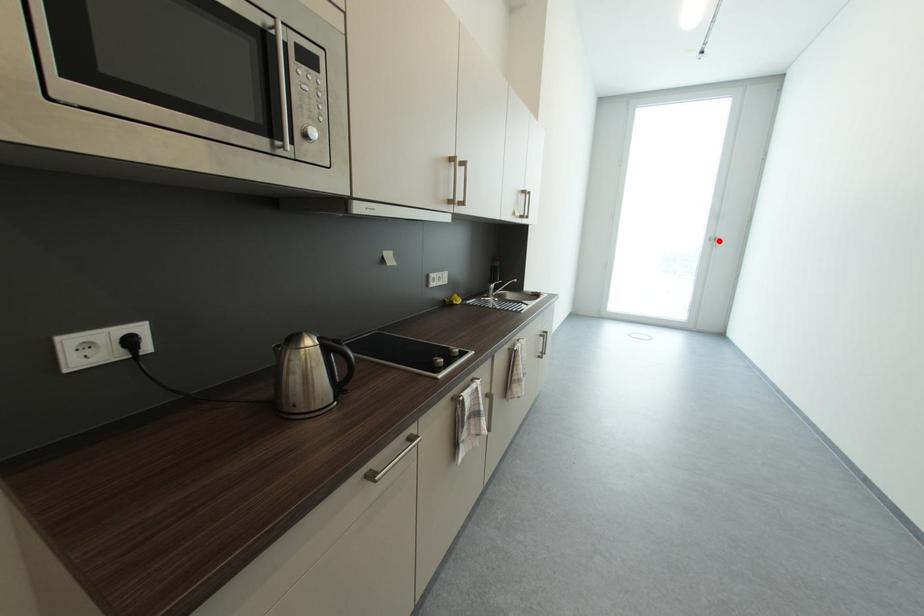
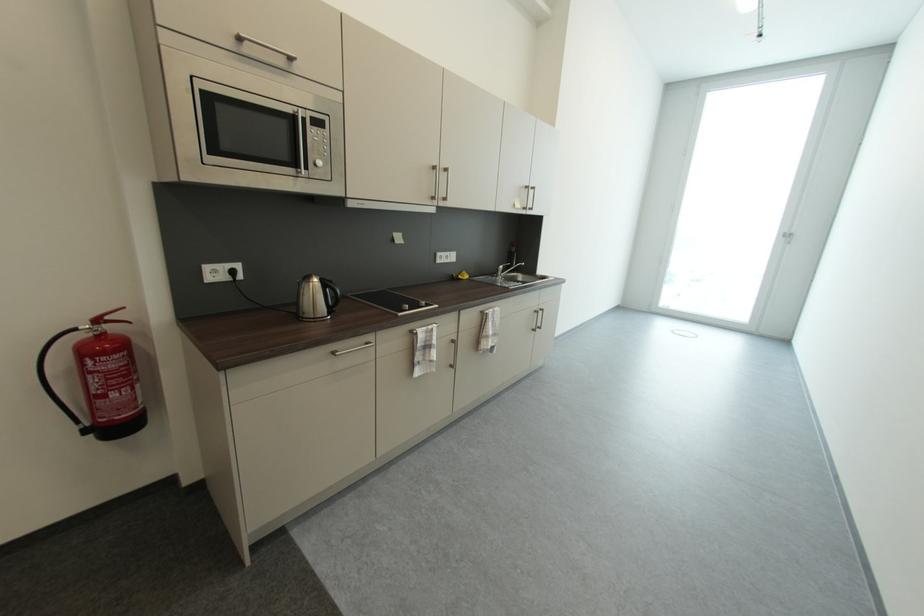
In the second image, find the point that corresponds to the highlighted location in the first image.

(794, 238)